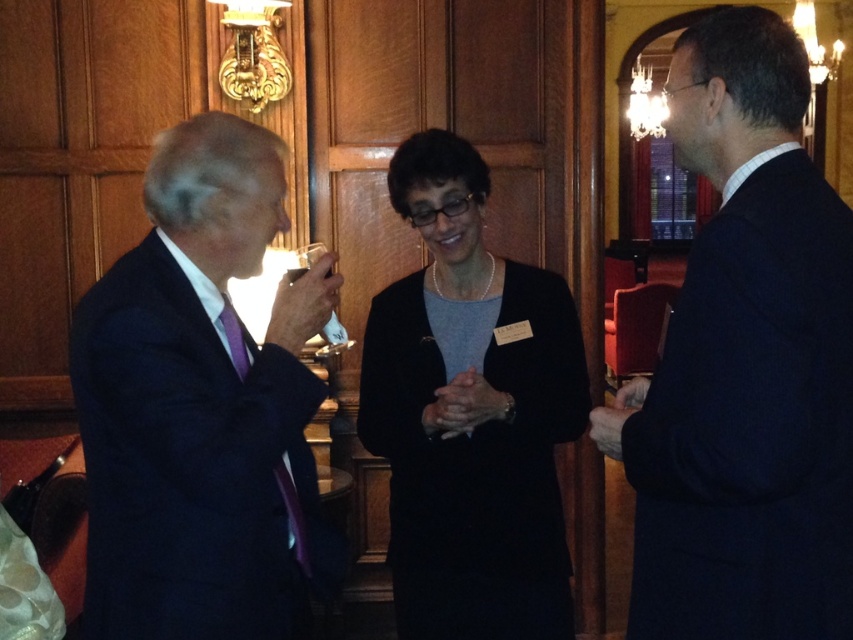
You are at a formal event and need to find the dark blue suit at left and the matte black cardigan at center. Which one is closer to the entrance of the room?

The dark blue suit at left is positioned over matte black cardigan at center, so the dark blue suit at left is closer to the entrance of the room.